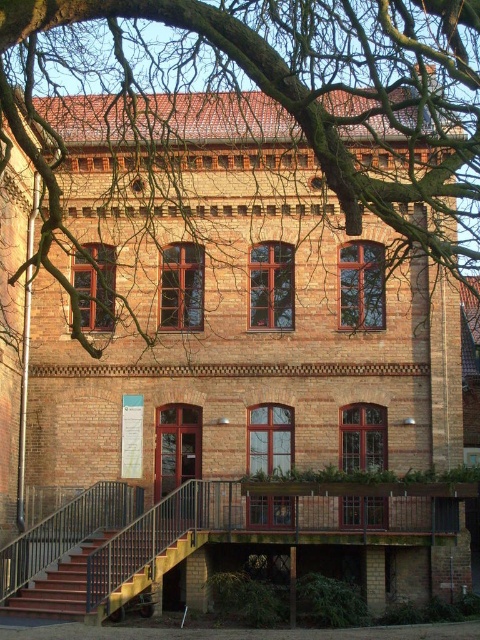
Question: Is bare branches at center behind wooden stairs at lower left?

Choices:
 (A) no
 (B) yes

Answer: (A)

Question: Which object appears farthest from the camera in this image?

Choices:
 (A) wooden stairs at lower left
 (B) bare branches at center

Answer: (A)

Question: Is bare branches at center positioned behind wooden stairs at lower left?

Choices:
 (A) no
 (B) yes

Answer: (A)

Question: Which point is closer to the camera taking this photo?

Choices:
 (A) (57, 600)
 (B) (468, 92)

Answer: (A)

Question: Is bare branches at center above wooden stairs at lower left?

Choices:
 (A) yes
 (B) no

Answer: (A)